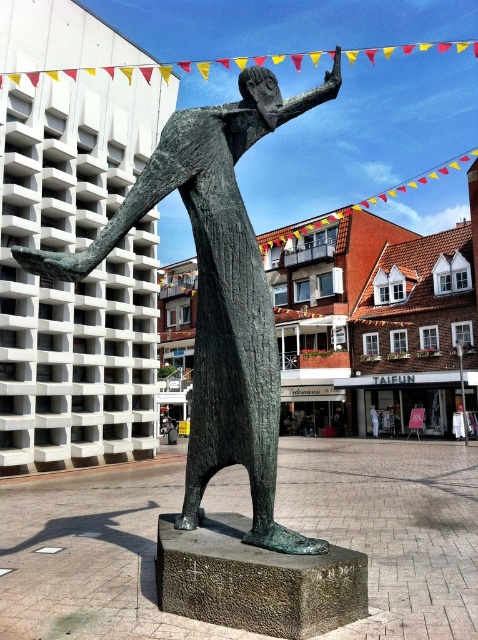
Question: Which point appears closest to the camera in this image?

Choices:
 (A) (264, 529)
 (B) (377, 424)

Answer: (A)

Question: Which point is closer to the camera?

Choices:
 (A) bronze statue at center
 (B) blue fabric person at center

Answer: (A)

Question: Does bronze statue at center have a smaller size compared to blue fabric person at center?

Choices:
 (A) yes
 (B) no

Answer: (B)

Question: Is bronze statue at center positioned in front of blue fabric person at center?

Choices:
 (A) no
 (B) yes

Answer: (B)

Question: Does bronze statue at center appear over blue fabric person at center?

Choices:
 (A) yes
 (B) no

Answer: (A)